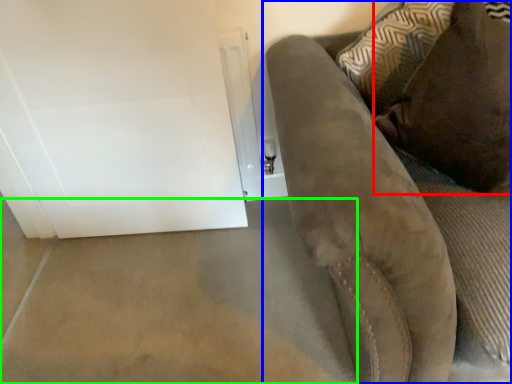
Question: Considering the real-world distances, which object is closest to pillow (highlighted by a red box)? furniture (highlighted by a blue box) or concrete (highlighted by a green box).

Choices:
 (A) furniture
 (B) concrete

Answer: (A)